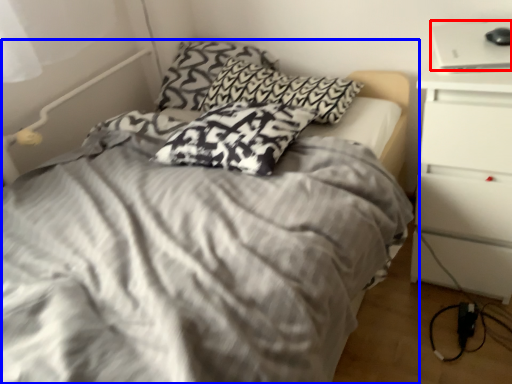
Question: Among these objects, which one is nearest to the camera, laptop (highlighted by a red box) or bed (highlighted by a blue box)?

Choices:
 (A) laptop
 (B) bed

Answer: (B)